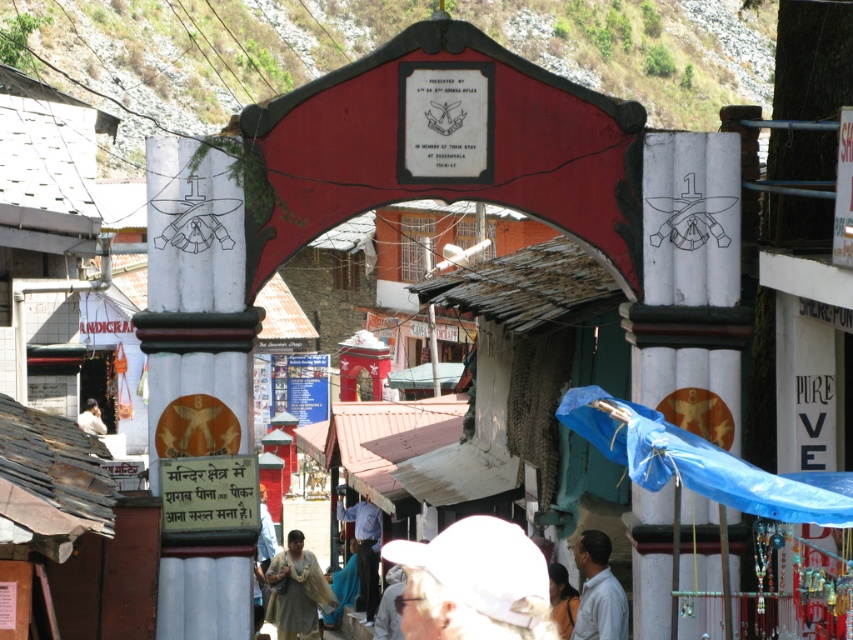
Question: Where is blue shirt at center located in relation to light brown fabric at lower center in the image?

Choices:
 (A) above
 (B) below

Answer: (B)

Question: Does white fabric cap at center appear on the left side of white matte shirt at lower center?

Choices:
 (A) yes
 (B) no

Answer: (A)

Question: Which point is farther to the camera?

Choices:
 (A) (590, 428)
 (B) (277, 552)

Answer: (B)

Question: Which object is positioned closest to the light beige fabric at center?

Choices:
 (A) white painted stone column at center
 (B) red painted wooden arch at center
 (C) light beige fabric at lower left
 (D) white matte shirt at lower center

Answer: (C)

Question: Which is farther from the light brown fabric at lower center?

Choices:
 (A) blue tarpaulin at center
 (B) white matte shirt at lower center

Answer: (A)

Question: Is the position of white painted stone column at center less distant than that of light brown fabric at lower center?

Choices:
 (A) no
 (B) yes

Answer: (B)